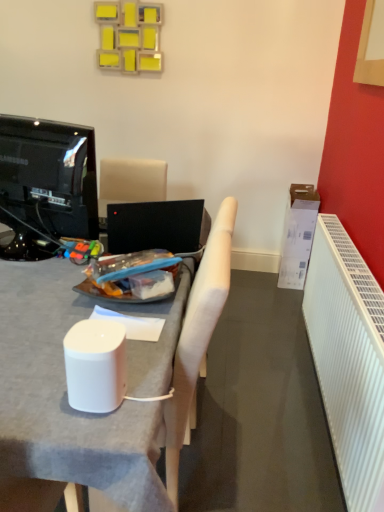
Where is `free point in front of black glossy television at left`? free point in front of black glossy television at left is located at coordinates (35, 284).